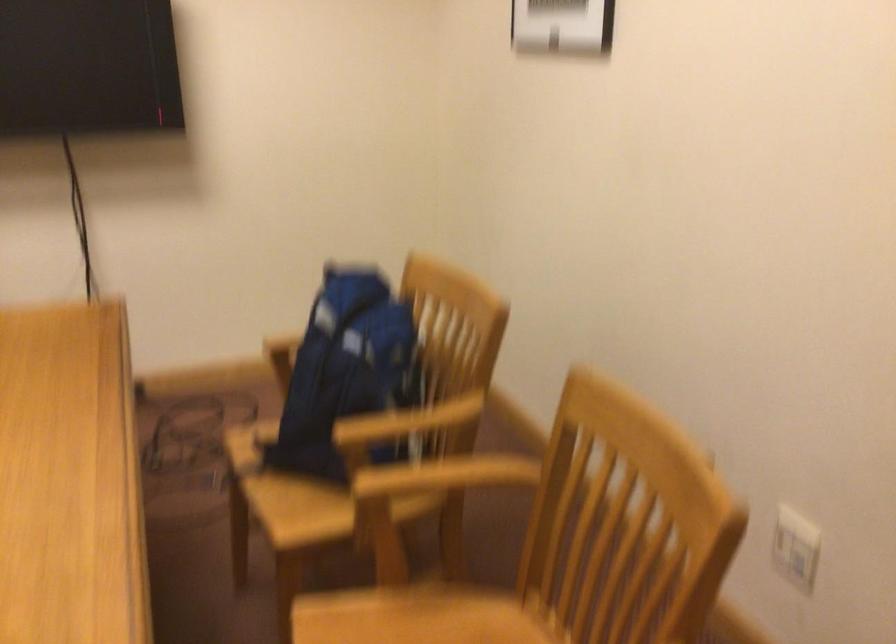
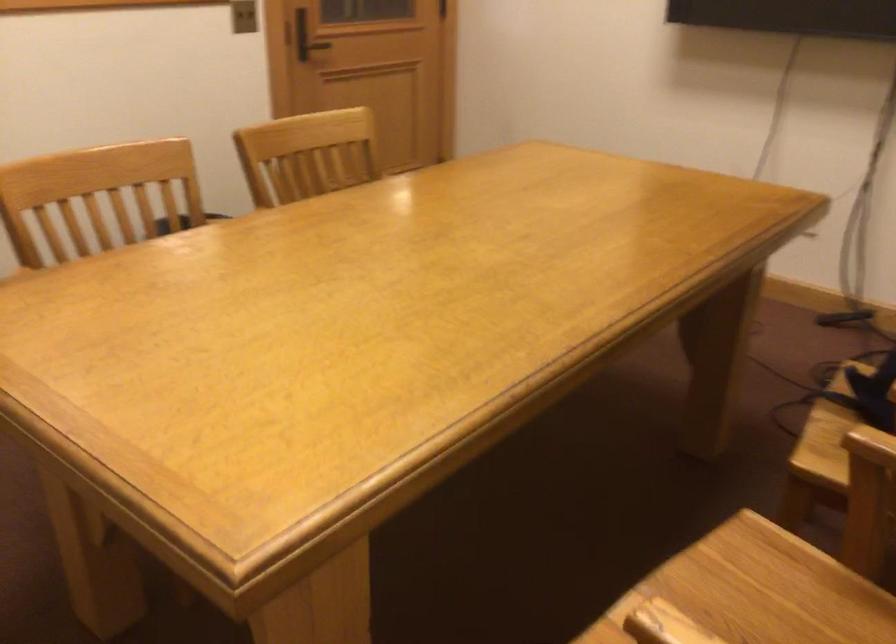
In the second image, find the point that corresponds to point (263, 485) in the first image.

(823, 419)